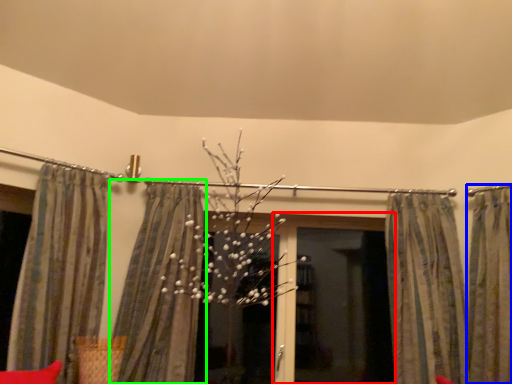
Question: Estimate the real-world distances between objects in this image. Which object is closer to screen door (highlighted by a red box), curtain (highlighted by a blue box) or curtain (highlighted by a green box)?

Choices:
 (A) curtain
 (B) curtain

Answer: (A)